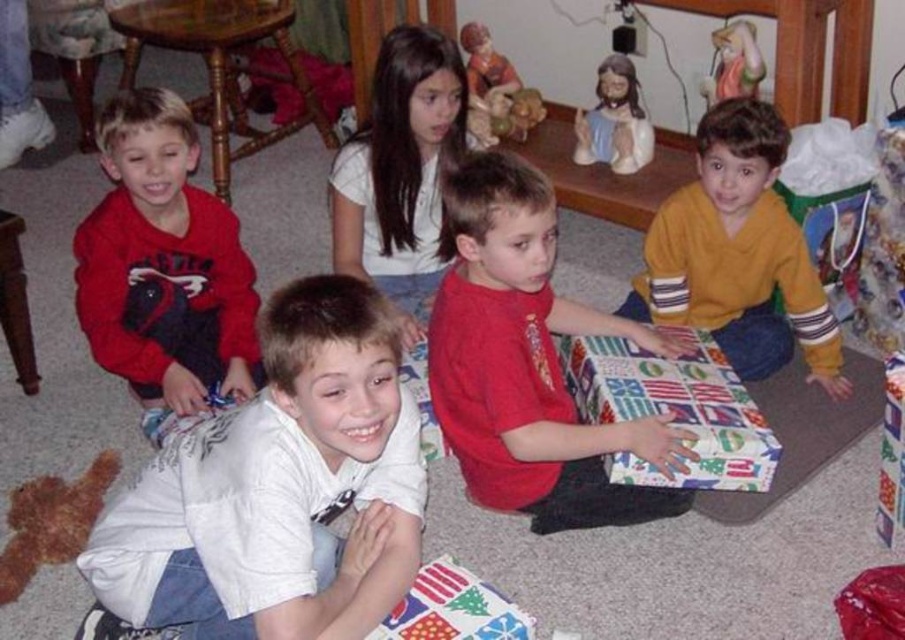
You are standing in the living room and want to hand a gift to the child wearing the yellow fleece sweater at right. Based on their position, where should you walk to find them?

The yellow fleece sweater at right is located at point (738, 253), so you should walk towards the right side of the living room to find the child wearing it.

In the scene shown: You are a parent organizing the gifts for the children. You need to place the yellow fleece sweater at right and the matte ceramic figurine at upper center into boxes. If the box for the sweater is the same size as the figurine box, will the sweater fit?

The yellow fleece sweater at right is wider than the matte ceramic figurine at upper center. Since the boxes are the same size, the sweater may not fit properly in the box meant for the figurine due to its greater width.